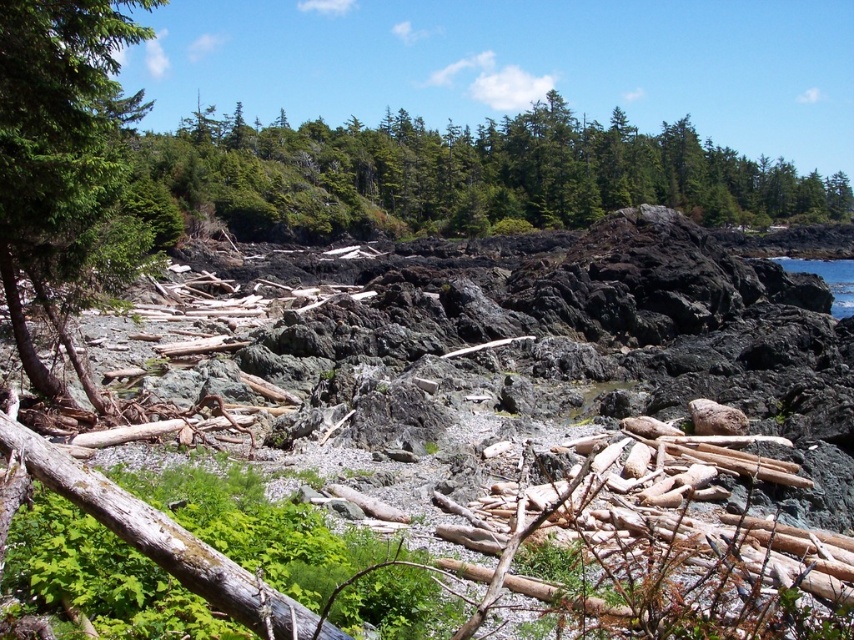
Based on the photo, is black rock at center above green textured trees at upper center?

No, black rock at center is not above green textured trees at upper center.

Is black rock at center thinner than green textured trees at upper center?

Indeed, black rock at center has a lesser width compared to green textured trees at upper center.

This screenshot has height=640, width=854. Describe the element at coordinates (611, 380) in the screenshot. I see `black rock at center` at that location.

You are a GUI agent. You are given a task and a screenshot of the screen. Output one action in this format:
    pyautogui.click(x=<x>, y=<y>)
    Task: Click on the black rock at center
    
    Given the screenshot: What is the action you would take?
    pyautogui.click(x=611, y=380)

Does green textured trees at upper center appear on the right side of blue water at upper right?

In fact, green textured trees at upper center is to the left of blue water at upper right.

Describe the element at coordinates (469, 173) in the screenshot. I see `green textured trees at upper center` at that location.

Who is more forward, [369,138] or [834,292]?

Point [834,292]

You are a GUI agent. You are given a task and a screenshot of the screen. Output one action in this format:
    pyautogui.click(x=<x>, y=<y>)
    Task: Click on the green textured trees at upper center
    The image size is (854, 640).
    Given the screenshot: What is the action you would take?
    pyautogui.click(x=469, y=173)

Is black rock at center to the left of blue water at upper right from the viewer's perspective?

Yes, black rock at center is to the left of blue water at upper right.

Where is `black rock at center`? black rock at center is located at coordinates (611, 380).